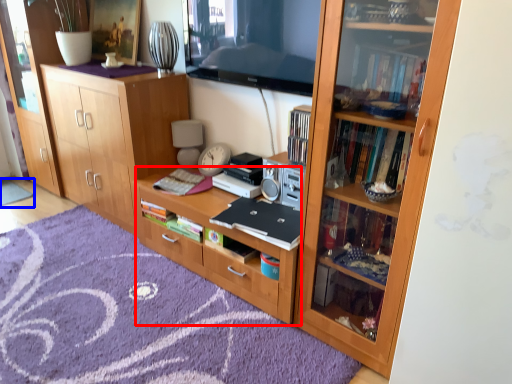
Question: Which of the following is the closest to the observer, desk (highlighted by a red box) or doormat (highlighted by a blue box)?

Choices:
 (A) desk
 (B) doormat

Answer: (A)